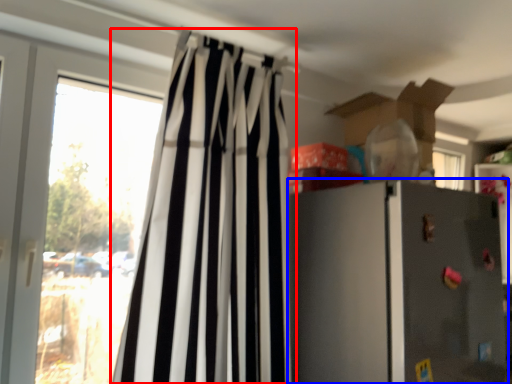
Question: Among these objects, which one is farthest to the camera, curtain (highlighted by a red box) or refrigerator (highlighted by a blue box)?

Choices:
 (A) curtain
 (B) refrigerator

Answer: (B)